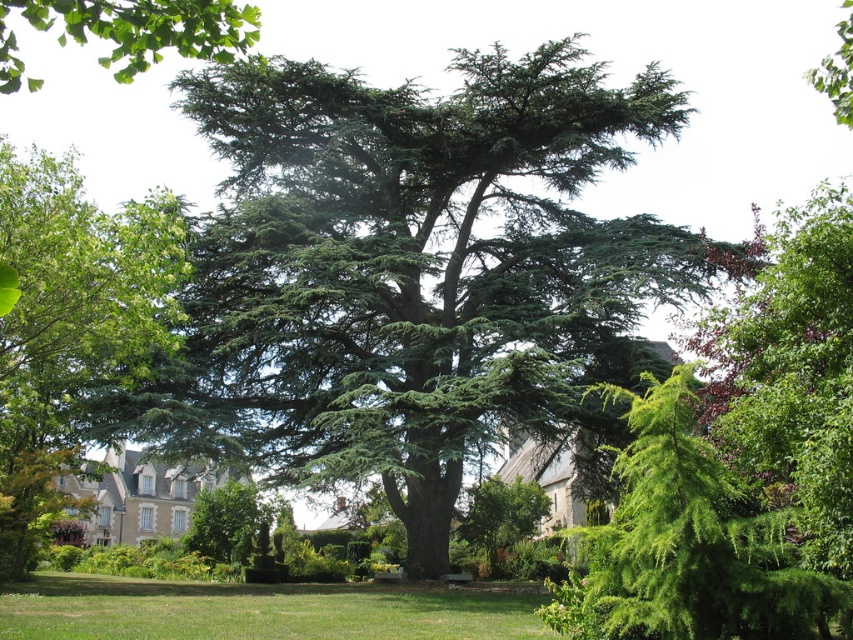
You are standing in the middle of a forest clearing and see a point marked at coordinates (410, 273). Which object in the scene does this point correspond to?

The point corresponds to the green needle like tree at center.